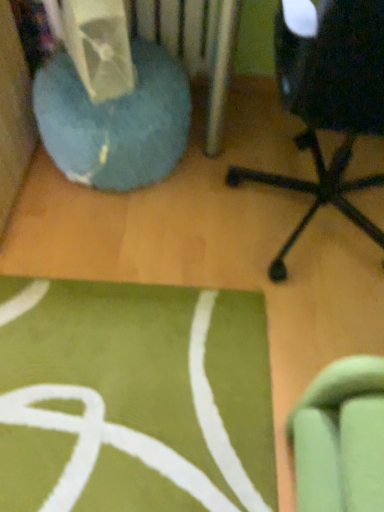
Question: Does black plastic chair at right have a larger size compared to blue fuzzy bean bag at left?

Choices:
 (A) no
 (B) yes

Answer: (B)

Question: Can you confirm if black plastic chair at right is wider than blue fuzzy bean bag at left?

Choices:
 (A) yes
 (B) no

Answer: (A)

Question: From a real-world perspective, is black plastic chair at right on top of blue fuzzy bean bag at left?

Choices:
 (A) no
 (B) yes

Answer: (B)

Question: From the image's perspective, does black plastic chair at right appear lower than blue fuzzy bean bag at left?

Choices:
 (A) no
 (B) yes

Answer: (B)

Question: From the image's perspective, does black plastic chair at right appear higher than blue fuzzy bean bag at left?

Choices:
 (A) yes
 (B) no

Answer: (B)

Question: Is black plastic chair at right taller than blue fuzzy bean bag at left?

Choices:
 (A) no
 (B) yes

Answer: (B)

Question: Does blue fuzzy bean bag at left have a smaller size compared to black plastic chair at right?

Choices:
 (A) no
 (B) yes

Answer: (B)

Question: Does blue fuzzy bean bag at left have a greater height compared to black plastic chair at right?

Choices:
 (A) no
 (B) yes

Answer: (A)

Question: Can you confirm if blue fuzzy bean bag at left is wider than black plastic chair at right?

Choices:
 (A) yes
 (B) no

Answer: (B)

Question: Considering the relative sizes of blue fuzzy bean bag at left and black plastic chair at right in the image provided, is blue fuzzy bean bag at left thinner than black plastic chair at right?

Choices:
 (A) no
 (B) yes

Answer: (B)

Question: Is blue fuzzy bean bag at left in front of black plastic chair at right?

Choices:
 (A) no
 (B) yes

Answer: (A)

Question: Is blue fuzzy bean bag at left not within black plastic chair at right?

Choices:
 (A) yes
 (B) no

Answer: (A)

Question: In terms of width, does blue fuzzy bean bag at left look wider or thinner when compared to black plastic chair at right?

Choices:
 (A) wide
 (B) thin

Answer: (B)